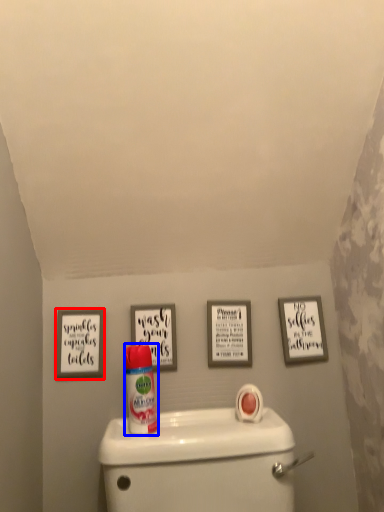
Question: Which point is closer to the camera, picture frame (highlighted by a red box) or cleaning product (highlighted by a blue box)?

Choices:
 (A) picture frame
 (B) cleaning product

Answer: (B)